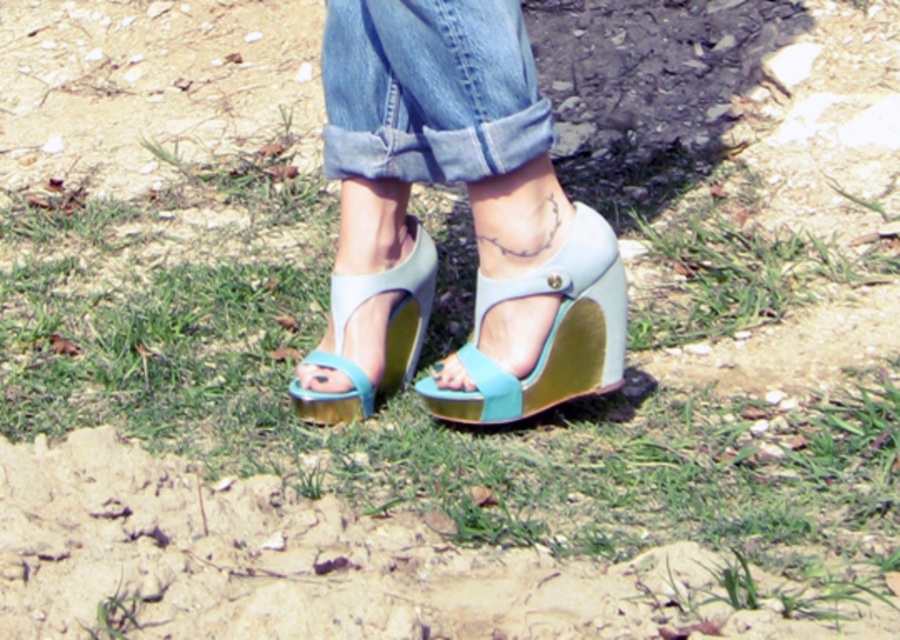
You are a photographer trying to capture the exact location of the light blue suede wedge at center in the image. According to the coordinates provided, where should you focus your camera lens?

The light blue suede wedge at center is located at coordinates point (547, 333), so you should focus your camera lens there.

You are trying to decide where to place a small pebble you found. You want to put it between the matte blue wedge sandals at center and the denim at center. Based on their positions, which object should you place the pebble closer to?

The matte blue wedge sandals at center are to the right of the denim at center, so you should place the pebble closer to the denim at center to ensure it stays between them.